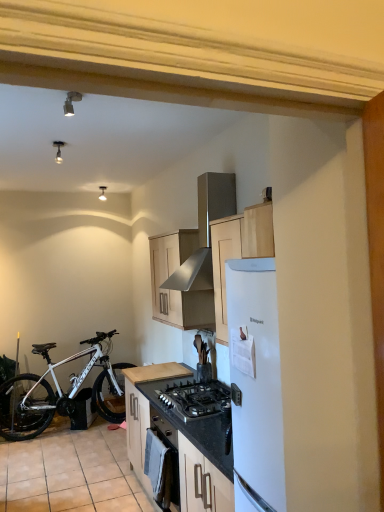
Question: Can you confirm if beige tile at lower left is taller than white matte bicycle at lower left?

Choices:
 (A) no
 (B) yes

Answer: (A)

Question: Are beige tile at lower left and white matte bicycle at lower left located far from each other?

Choices:
 (A) yes
 (B) no

Answer: (B)

Question: Can you confirm if beige tile at lower left is thinner than white matte bicycle at lower left?

Choices:
 (A) no
 (B) yes

Answer: (A)

Question: From a real-world perspective, is beige tile at lower left positioned under white matte bicycle at lower left based on gravity?

Choices:
 (A) yes
 (B) no

Answer: (A)

Question: Does beige tile at lower left touch white matte bicycle at lower left?

Choices:
 (A) no
 (B) yes

Answer: (A)

Question: From the image's perspective, relative to black matte oven at center, is light wood cabinet at center, which is the 2th cabinetry from top to bottom, above or below?

Choices:
 (A) above
 (B) below

Answer: (B)

Question: Choose the correct answer: Is light wood cabinet at center, which is the 2th cabinetry from top to bottom, inside black matte oven at center or outside it?

Choices:
 (A) outside
 (B) inside

Answer: (A)

Question: From a real-world perspective, is light wood cabinet at center, marked as the 1th cabinetry in a bottom-to-top arrangement, positioned above or below black matte oven at center?

Choices:
 (A) below
 (B) above

Answer: (A)

Question: In terms of height, does light wood cabinet at center, marked as the 1th cabinetry in a bottom-to-top arrangement, look taller or shorter compared to black matte oven at center?

Choices:
 (A) tall
 (B) short

Answer: (A)

Question: Is light wood cabinet at center, marked as the 1th cabinetry in a bottom-to-top arrangement, situated inside stainless steel range hood at upper center or outside?

Choices:
 (A) inside
 (B) outside

Answer: (B)

Question: Visually, is light wood cabinet at center, marked as the 1th cabinetry in a bottom-to-top arrangement, positioned to the left or to the right of stainless steel range hood at upper center?

Choices:
 (A) left
 (B) right

Answer: (A)

Question: Considering the positions of light wood cabinet at center, marked as the 1th cabinetry in a bottom-to-top arrangement, and stainless steel range hood at upper center in the image, is light wood cabinet at center, marked as the 1th cabinetry in a bottom-to-top arrangement, taller or shorter than stainless steel range hood at upper center?

Choices:
 (A) tall
 (B) short

Answer: (B)

Question: From the image's perspective, is light wood cabinet at center, which is the 2th cabinetry from top to bottom, above or below stainless steel range hood at upper center?

Choices:
 (A) above
 (B) below

Answer: (B)

Question: From a real-world perspective, is black matte oven at center above or below white matte bicycle at lower left?

Choices:
 (A) below
 (B) above

Answer: (A)

Question: Is black matte oven at center inside the boundaries of white matte bicycle at lower left, or outside?

Choices:
 (A) inside
 (B) outside

Answer: (B)